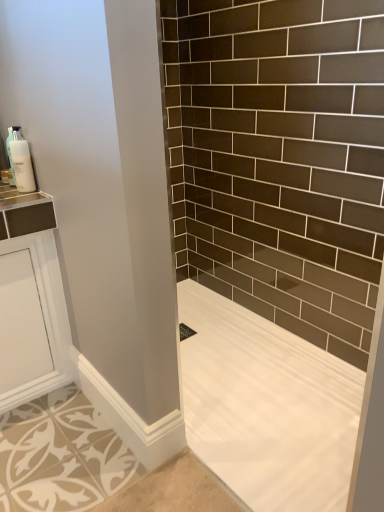
Question: From their relative heights in the image, would you say white glossy soap dispenser at upper left is taller or shorter than white smooth bathtub at lower right?

Choices:
 (A) tall
 (B) short

Answer: (A)

Question: Is point (11, 169) positioned closer to the camera than point (279, 510)?

Choices:
 (A) closer
 (B) farther

Answer: (B)

Question: Based on their positions, is white glossy soap dispenser at upper left located to the left or right of white smooth bathtub at lower right?

Choices:
 (A) right
 (B) left

Answer: (B)

Question: Considering the positions of point (306, 384) and point (31, 181), is point (306, 384) closer or farther from the camera than point (31, 181)?

Choices:
 (A) farther
 (B) closer

Answer: (A)

Question: From a real-world perspective, is white smooth bathtub at lower right physically located above or below white glossy soap dispenser at upper left?

Choices:
 (A) below
 (B) above

Answer: (A)

Question: In the image, is white smooth bathtub at lower right positioned in front of or behind white glossy soap dispenser at upper left?

Choices:
 (A) front
 (B) behind

Answer: (A)

Question: Is white smooth bathtub at lower right bigger or smaller than white glossy soap dispenser at upper left?

Choices:
 (A) big
 (B) small

Answer: (A)